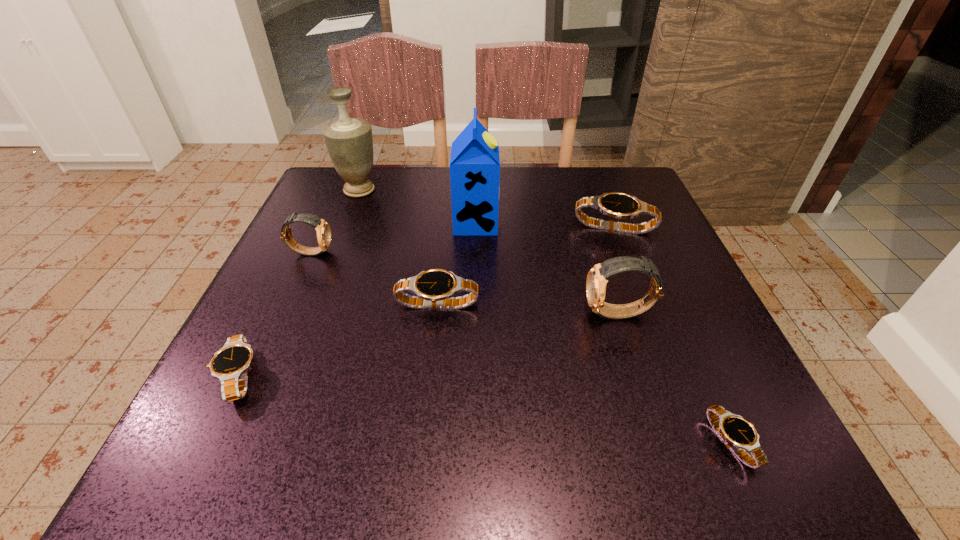
Image resolution: width=960 pixels, height=540 pixels. I want to click on the third farthest black watch, so click(230, 364).

I want to click on the seventh farthest object, so click(x=230, y=364).

Identify the location of the smallest black watch. The width and height of the screenshot is (960, 540). (739, 434).

Find the location of `the shortest object`. the shortest object is located at coordinates (739, 434).

This screenshot has height=540, width=960. Find the location of `vacant space situated on the front of the farthest object`. vacant space situated on the front of the farthest object is located at coordinates (315, 303).

You are a GUI agent. You are given a task and a screenshot of the screen. Output one action in this format:
    pyautogui.click(x=<x>, y=<y>)
    Task: Click on the free point located 0.340m with the cap open on the carton
    The height and width of the screenshot is (540, 960).
    Given the screenshot: What is the action you would take?
    pyautogui.click(x=649, y=222)

The image size is (960, 540). I want to click on vacant region located 0.220m on the face of the right gold watch, so click(461, 314).

What are the coordinates of `blank space located on the face of the right gold watch` in the screenshot? It's located at (523, 314).

You are a GUI agent. You are given a task and a screenshot of the screen. Output one action in this format:
    pyautogui.click(x=<x>, y=<y>)
    Task: Click on the free space located on the face of the right gold watch
    
    Given the screenshot: What is the action you would take?
    pyautogui.click(x=529, y=314)

The height and width of the screenshot is (540, 960). Identify the location of vacant space located on the face of the second tallest watch. (516, 252).